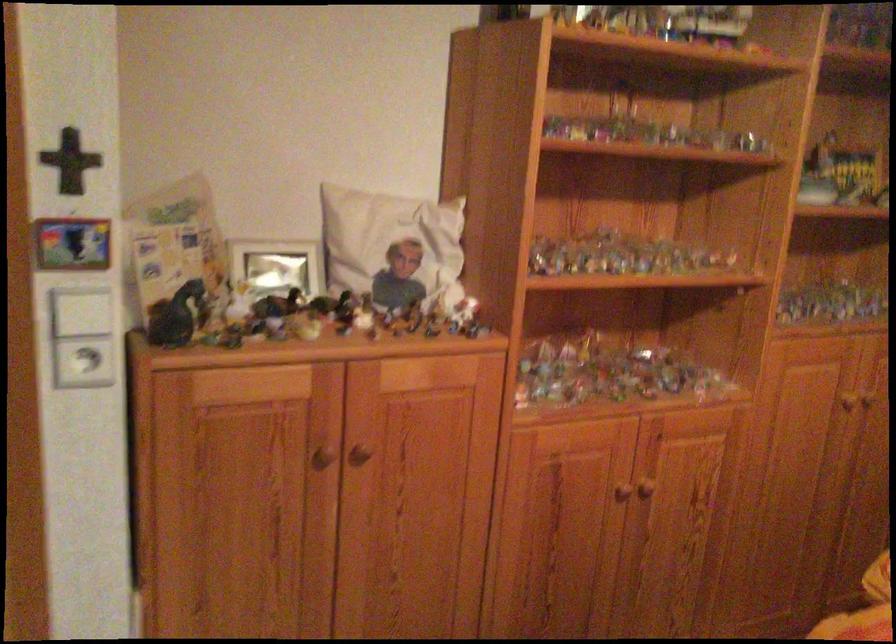
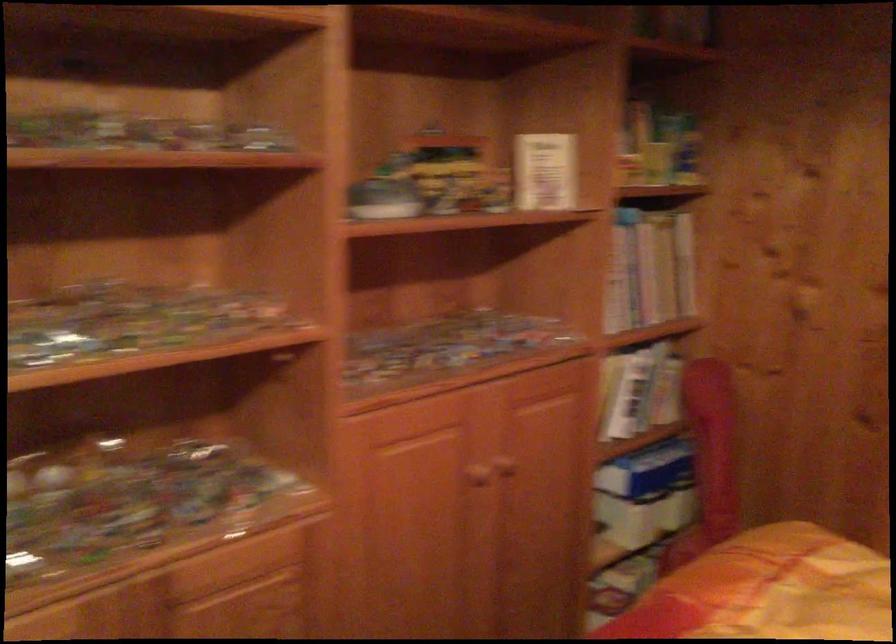
Question: How did the camera likely rotate?

Choices:
 (A) Left
 (B) Right
 (C) Up
 (D) Down

Answer: (B)